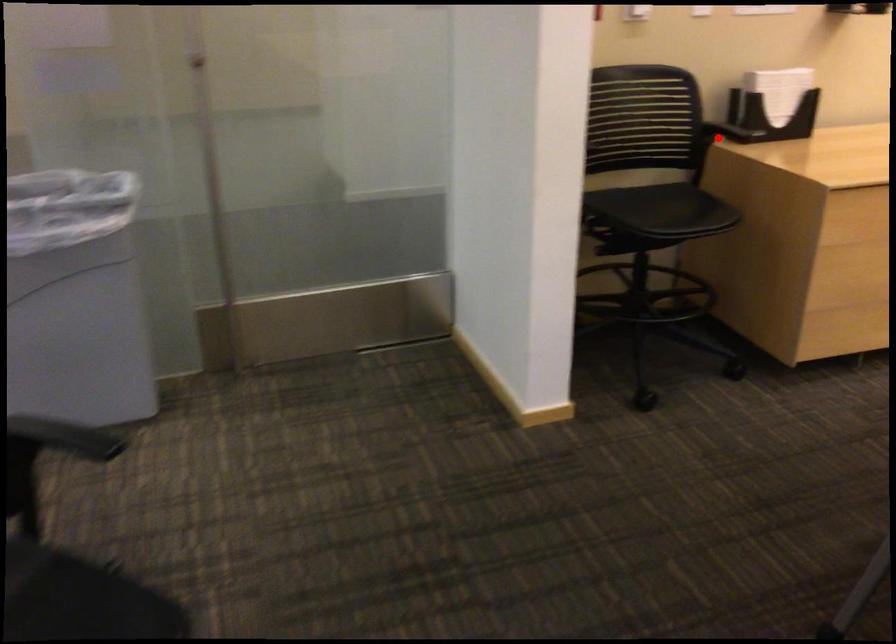
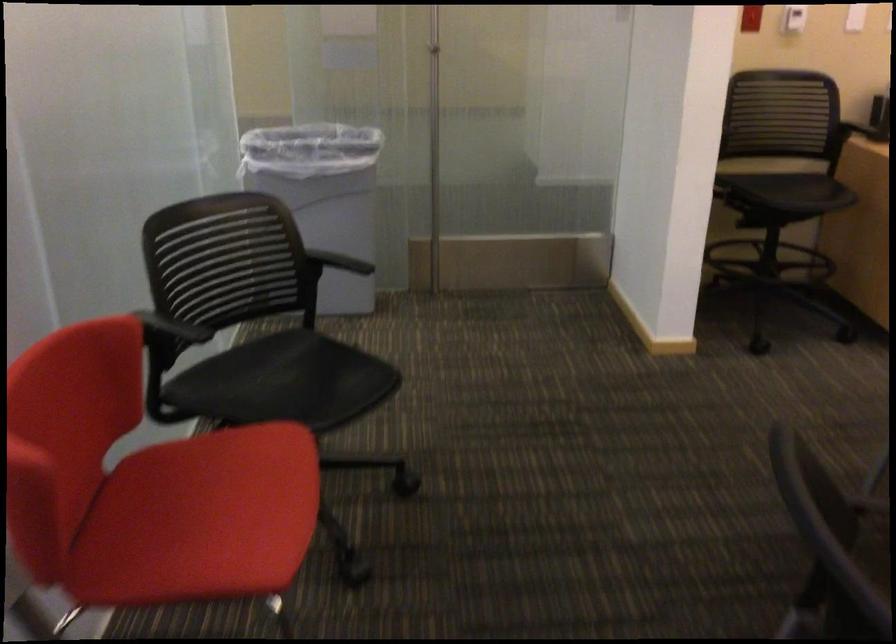
Find the pixel in the second image that matches the highlighted location in the first image.

(858, 131)